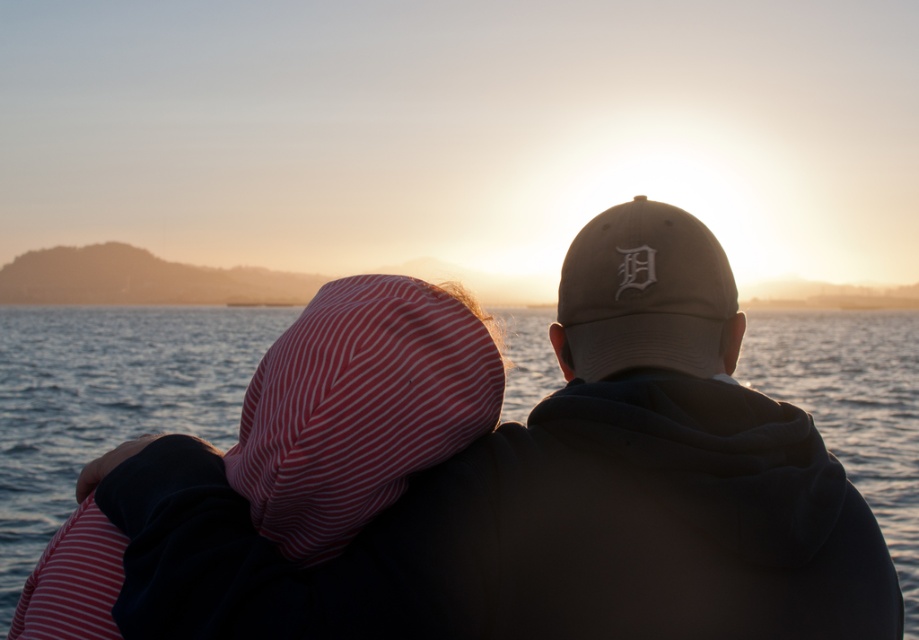
You are a photographer trying to capture the khaki fabric cap at upper right and the blue water at center in a single shot. Which object will appear narrower in your photo?

The khaki fabric cap at upper right is thinner than the blue water at center, so it will appear narrower in the photo.

You are a photographer trying to capture the khaki fabric cap at upper right in the center of your photo. Given that the camera has a rectangular frame, can you estimate whether the cap is already centered or needs adjustment to the left or right?

The khaki fabric cap at upper right is located at coordinates point 0.727 on the x axis and 0.734 on the y axis. Since the center of the frame would be at point 0.5 on both axes, the cap is positioned to the right of center and needs adjustment to the left to center it.

Looking at this image, you are a photographer trying to capture the khaki fabric cap at upper right and the blue water at center in a single shot. Since the cap is closer to you than the water, will the cap appear larger in the photo compared to the water?

The khaki fabric cap at upper right is positioned over blue water at center. Since the cap is closer to the camera, it will naturally appear larger in the photo compared to the blue water at center which is farther away.